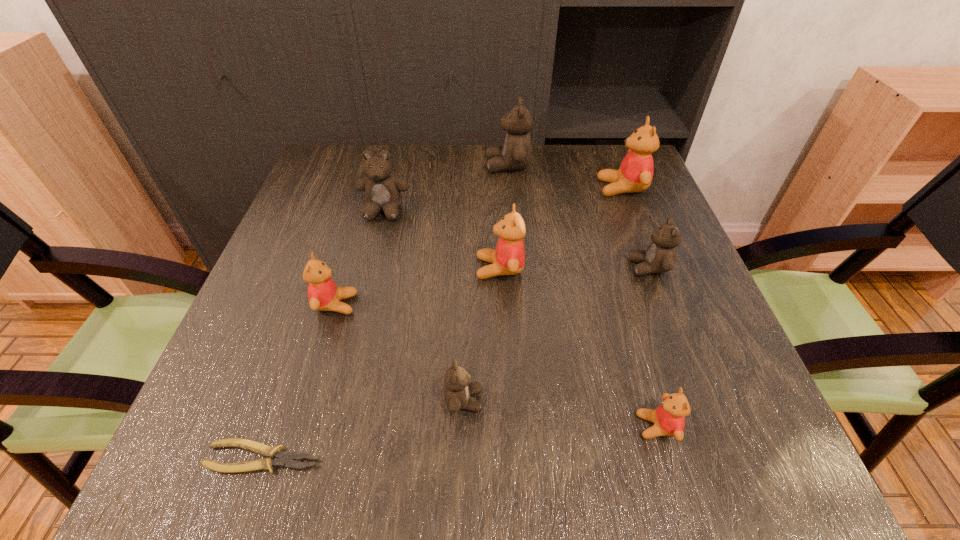
At what (x,y) coordinates should I click in order to perform the action: click on free space located 0.250m on the face of the leftmost brown teddy bear. Please return your answer as a coordinate pair (x, y). Image resolution: width=960 pixels, height=540 pixels. Looking at the image, I should click on (361, 306).

Where is `free space located on the front-facing side of the second red teddy bear from left to right`? The width and height of the screenshot is (960, 540). free space located on the front-facing side of the second red teddy bear from left to right is located at coordinates (367, 268).

Locate an element on the screen. free location located on the front-facing side of the second red teddy bear from left to right is located at coordinates (396, 268).

At what (x,y) coordinates should I click in order to perform the action: click on vacant space located 0.350m on the front-facing side of the second red teddy bear from left to right. Please return your answer as a coordinate pair (x, y). This screenshot has height=540, width=960. Looking at the image, I should click on (309, 268).

This screenshot has width=960, height=540. In order to click on blank area located on the front-facing side of the leftmost red teddy bear in this screenshot , I will do `click(506, 304)`.

Locate an element on the screen. vacant space located on the face of the rightmost brown teddy bear is located at coordinates (476, 268).

You are a GUI agent. You are given a task and a screenshot of the screen. Output one action in this format:
    pyautogui.click(x=<x>, y=<y>)
    Task: Click on the free region located on the face of the rightmost brown teddy bear
    This screenshot has width=960, height=540.
    Given the screenshot: What is the action you would take?
    pyautogui.click(x=548, y=268)

Identify the location of vacant space situated on the face of the rightmost brown teddy bear. (529, 268).

The height and width of the screenshot is (540, 960). Find the location of `free space located on the face of the nearest brown teddy bear`. free space located on the face of the nearest brown teddy bear is located at coordinates (576, 400).

The height and width of the screenshot is (540, 960). Find the location of `vacant space located 0.150m on the front-facing side of the smallest red teddy bear`. vacant space located 0.150m on the front-facing side of the smallest red teddy bear is located at coordinates (541, 426).